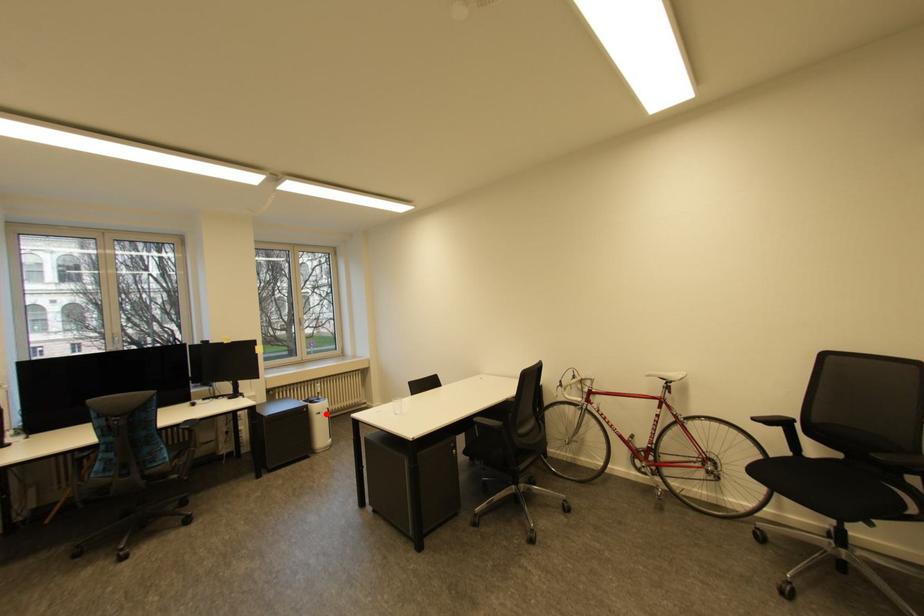
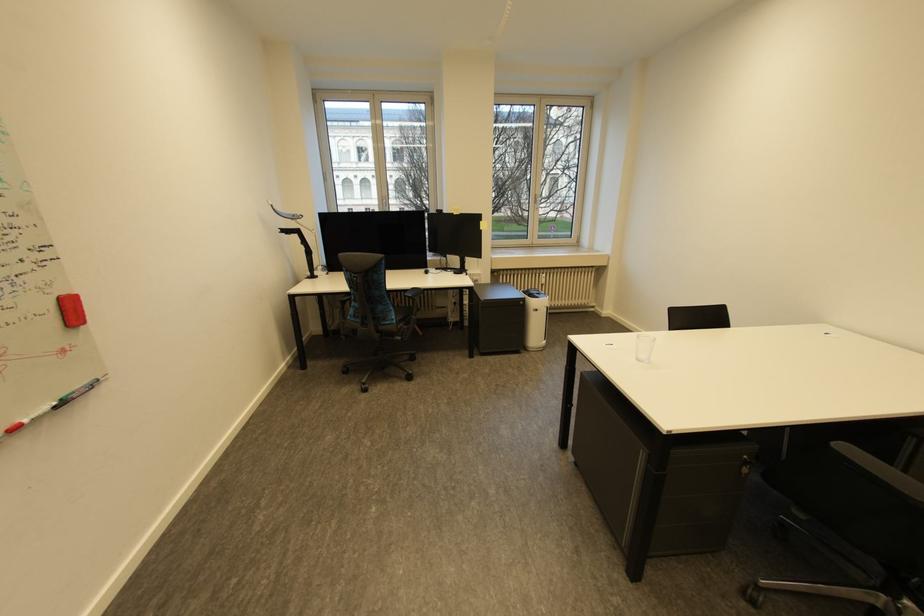
Question: I am providing you with two images of the same scene from different viewpoints. A red point is marked on the first image. At the location where the point appears in image 1, is it still visible in image 2?

Choices:
 (A) Yes
 (B) No

Answer: (A)